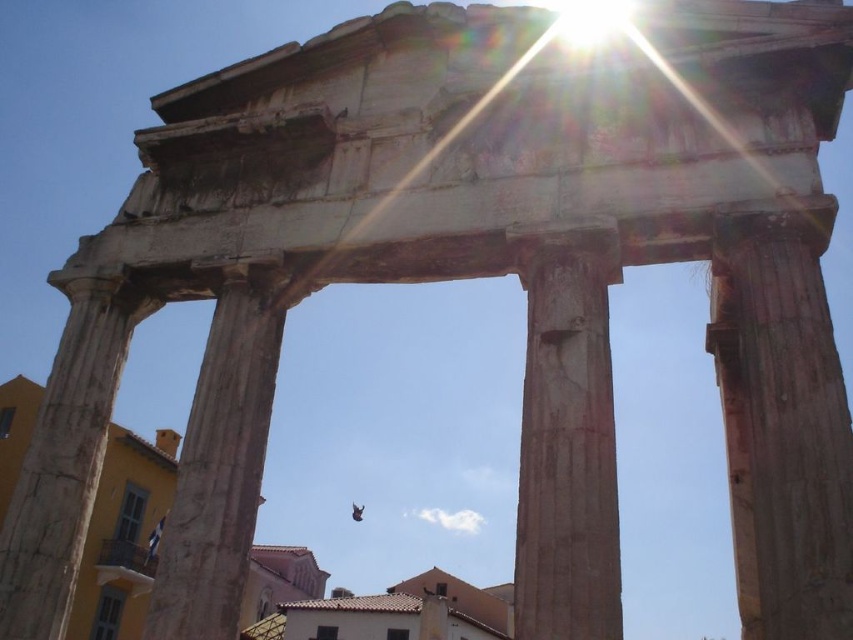
You are standing in front of the ancient structure and want to touch the closest stone structure. Which one should you reach for between the smooth stone column at center and the smooth stone pillar at left?

The smooth stone column at center is closer to the viewer than the smooth stone pillar at left, so you should reach for the smooth stone column at center.

You are an architect examining the ancient structure. You notice the smooth stone column at right and the brown stone column at center. Which column is shorter?

The smooth stone column at right has a lesser height compared to the brown stone column at center, so the smooth stone column at right is shorter.

You are standing in front of the ancient structure and want to take a photo of both the smooth stone column at right and the brown stone column at center. Which column should you move towards to include both in your frame without changing your position?

You should move towards the brown stone column at center because the smooth stone column at right is to the right of it, so positioning yourself closer to the center column would allow both columns to be captured in the frame.